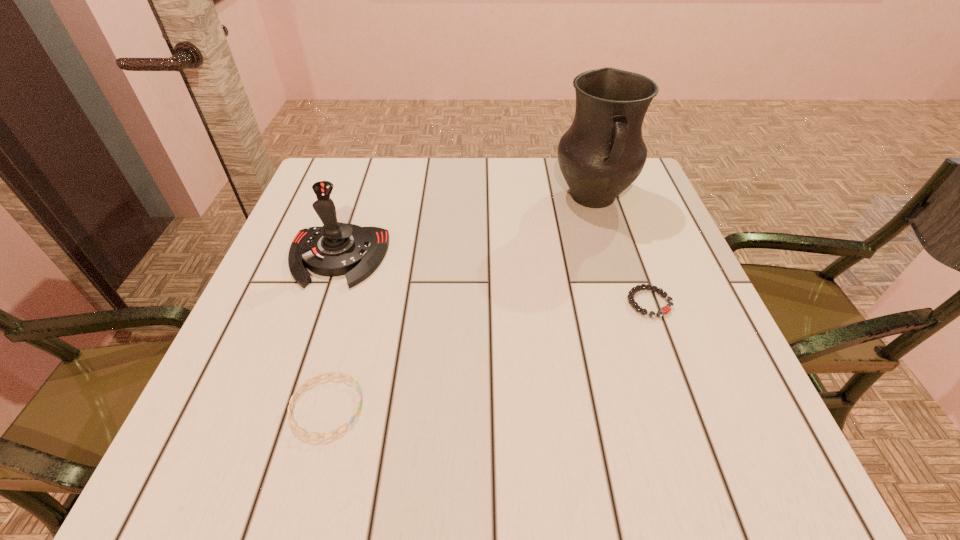
The image size is (960, 540). What are the coordinates of `free space located 0.110m on the left of the shorter bracelet` in the screenshot? It's located at (572, 303).

The width and height of the screenshot is (960, 540). In order to click on object at the far edge in this screenshot , I will do `click(602, 153)`.

The image size is (960, 540). What are the coordinates of `object present at the near edge` in the screenshot? It's located at (290, 419).

Locate an element on the screen. Image resolution: width=960 pixels, height=540 pixels. joystick located at the left edge is located at coordinates pos(335,249).

The image size is (960, 540). What are the coordinates of `bracelet positioned at the left edge` in the screenshot? It's located at (290, 419).

Locate an element on the screen. The image size is (960, 540). pitcher at the right edge is located at coordinates (602, 153).

Identify the location of bracelet present at the right edge. (666, 309).

I want to click on object located at the near left corner, so click(x=290, y=419).

Where is `object present at the far right corner`? object present at the far right corner is located at coordinates (602, 153).

At what (x,y) coordinates should I click in order to perform the action: click on vacant space at the far edge. Please return your answer as a coordinate pair (x, y). The width and height of the screenshot is (960, 540). Looking at the image, I should click on (388, 201).